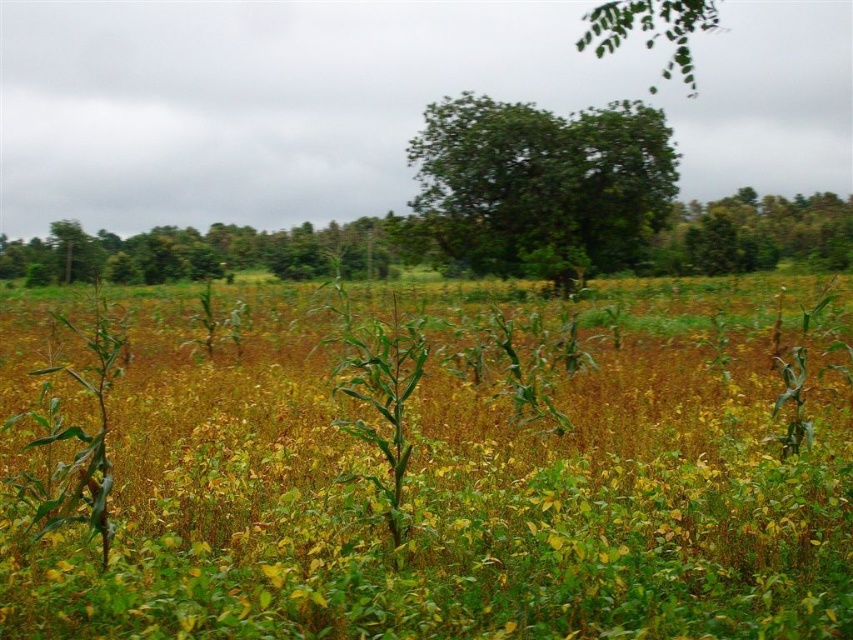
Question: Can you confirm if green grass at center is positioned to the right of green leafy tree at left?

Choices:
 (A) yes
 (B) no

Answer: (A)

Question: Can you confirm if green grass at center is positioned to the left of green leafy tree at left?

Choices:
 (A) no
 (B) yes

Answer: (A)

Question: Among these objects, which one is nearest to the camera?

Choices:
 (A) green leafy tree at center
 (B) green leafy tree at left
 (C) green grass at center

Answer: (C)

Question: Does green leafy tree at center have a larger size compared to green leafy tree at left?

Choices:
 (A) yes
 (B) no

Answer: (A)

Question: Which point is closer to the camera?

Choices:
 (A) green leafy tree at left
 (B) green grass at center

Answer: (B)

Question: Based on their relative distances, which object is nearer to the green leafy tree at left?

Choices:
 (A) green leafy tree at center
 (B) green grass at center

Answer: (A)